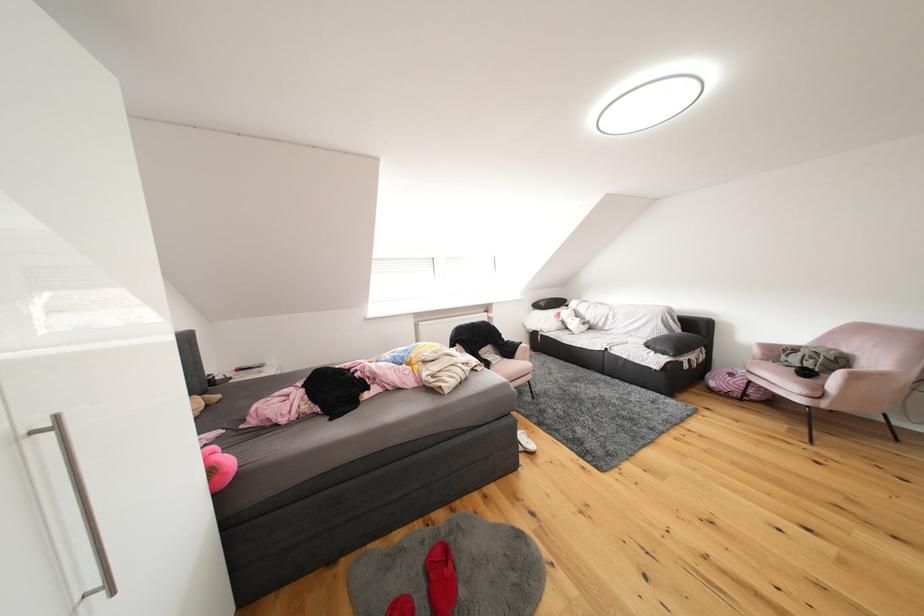
The width and height of the screenshot is (924, 616). What do you see at coordinates (865, 390) in the screenshot?
I see `the pink chair armrest` at bounding box center [865, 390].